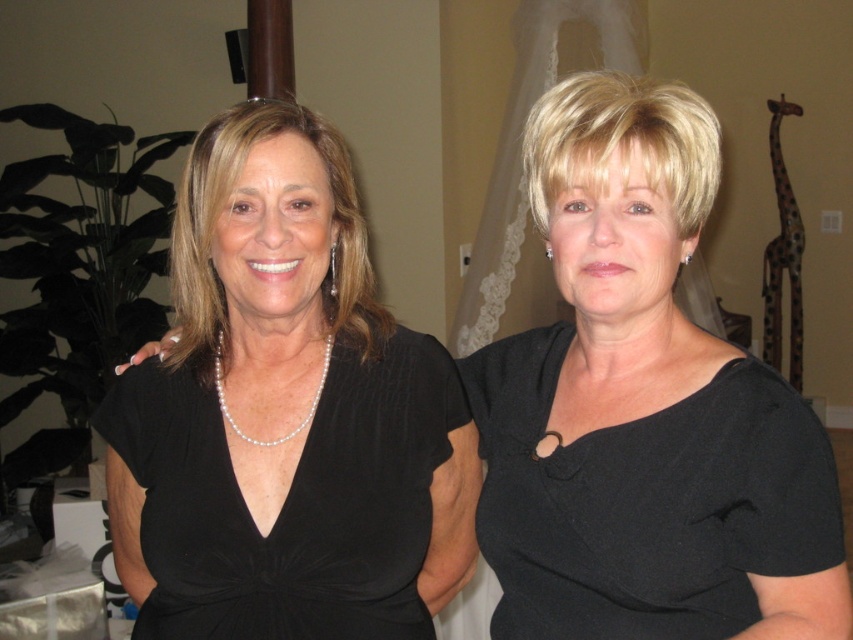
Looking at this image, is black matte dress at center to the left of black satin dress at center from the viewer's perspective?

No, black matte dress at center is not to the left of black satin dress at center.

Is point (584, 573) closer to viewer compared to point (161, 392)?

That is True.

Between point (483, 371) and point (384, 500), which one is positioned behind?

Point (483, 371)

Where is `black matte dress at center`? The width and height of the screenshot is (853, 640). black matte dress at center is located at coordinates (645, 500).